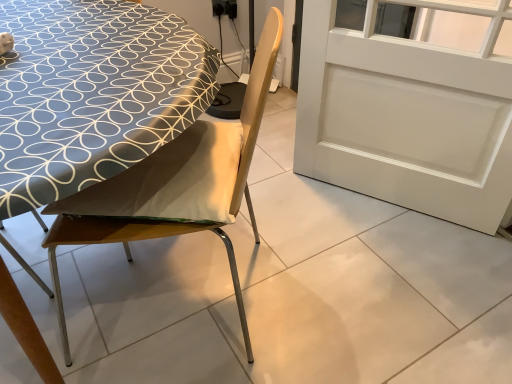
Locate an element on the screen. The width and height of the screenshot is (512, 384). free point to the right of wooden chair at center is located at coordinates (340, 285).